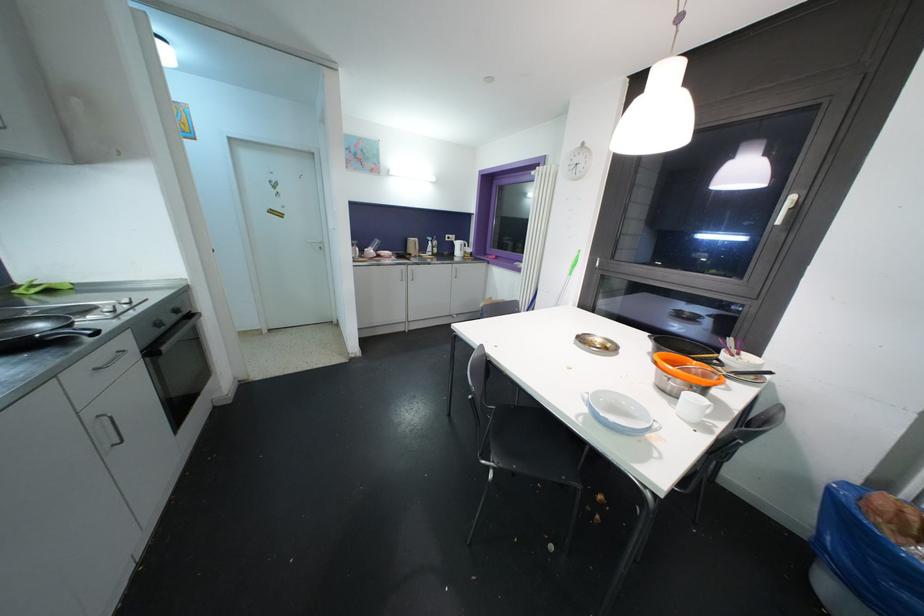
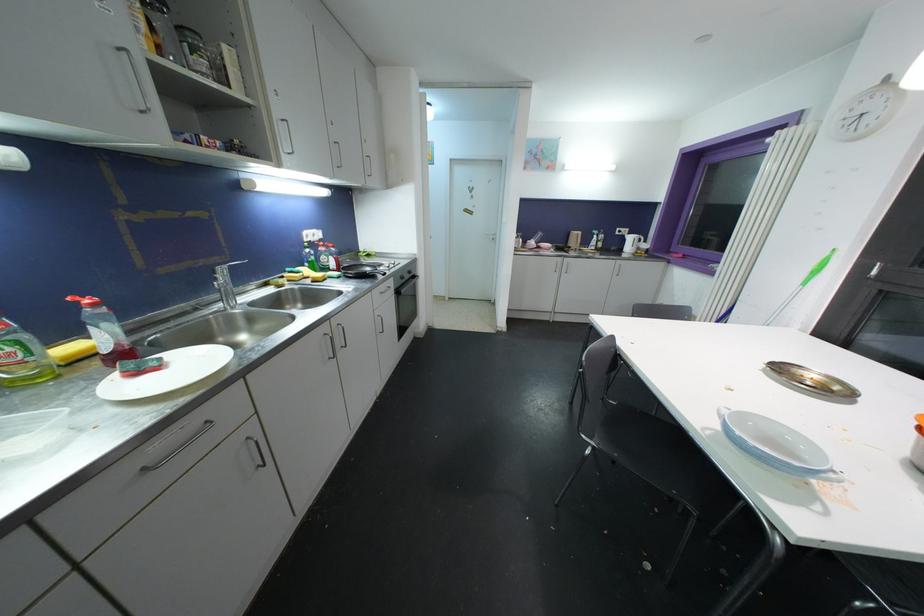
Find the pixel in the second image that matches point (179, 314) in the first image.

(412, 275)